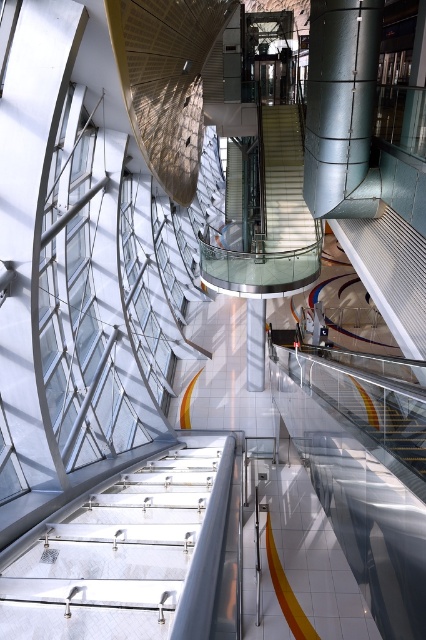
You are an architect designing a new building and want to ensure that the metallic silver pillar at upper center and the white glossy stairs at center are proportionate. Based on the image, which object is taller?

The metallic silver pillar at upper center is taller than the white glossy stairs at center.

You are a maintenance worker needing to move a 5.5 meter long pipe from the lower floor to the upper floor. You see the metallic silver pillar at upper center and the white glossy pillar at center. Can you safely carry the pipe horizontally between these two pillars without tilting it?

The distance between the metallic silver pillar at upper center and the white glossy pillar at center is 5.22 meters. Since the pipe is 5.5 meters long, it is slightly longer than the gap between the pillars. Therefore, it would not be safe to carry the pipe horizontally between them without tilting it as there isn not enough space.

You are a maintenance worker needing to reach the metallic silver pillar at upper center from the white glossy stairs at center. Given that your ladder is 5 meters long, will it be sufficient to reach the pillar?

The metallic silver pillar at upper center is 5.63 meters away from the white glossy stairs at center. Since the ladder is only 5 meters long, it will not be sufficient to reach the pillar.